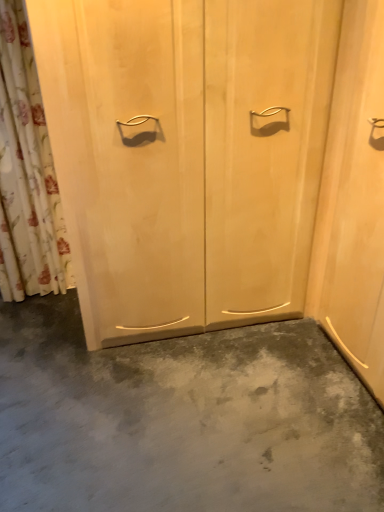
You are a GUI agent. You are given a task and a screenshot of the screen. Output one action in this format:
    pyautogui.click(x=<x>, y=<y>)
    Task: Click on the vacant space underneath floral fabric shower curtain at left (from a real-world perspective)
    
    Given the screenshot: What is the action you would take?
    pyautogui.click(x=38, y=295)